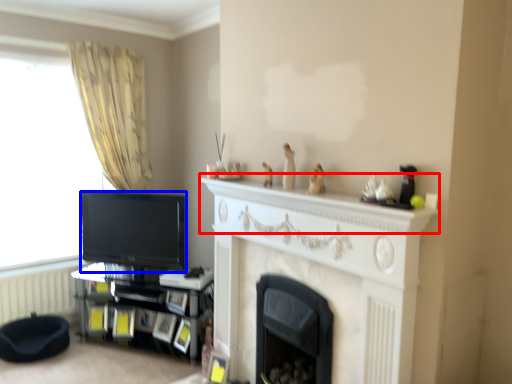
Question: Which of the following is the farthest to the observer, mantle (highlighted by a red box) or television (highlighted by a blue box)?

Choices:
 (A) mantle
 (B) television

Answer: (B)